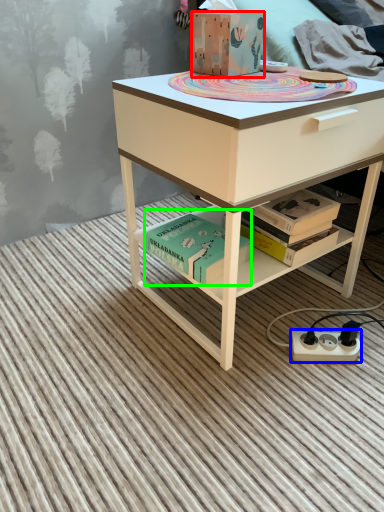
Question: Which object is positioned closest to box (highlighted by a red box)? Select from power plugs and sockets (highlighted by a blue box) and book (highlighted by a green box).

Choices:
 (A) power plugs and sockets
 (B) book

Answer: (B)